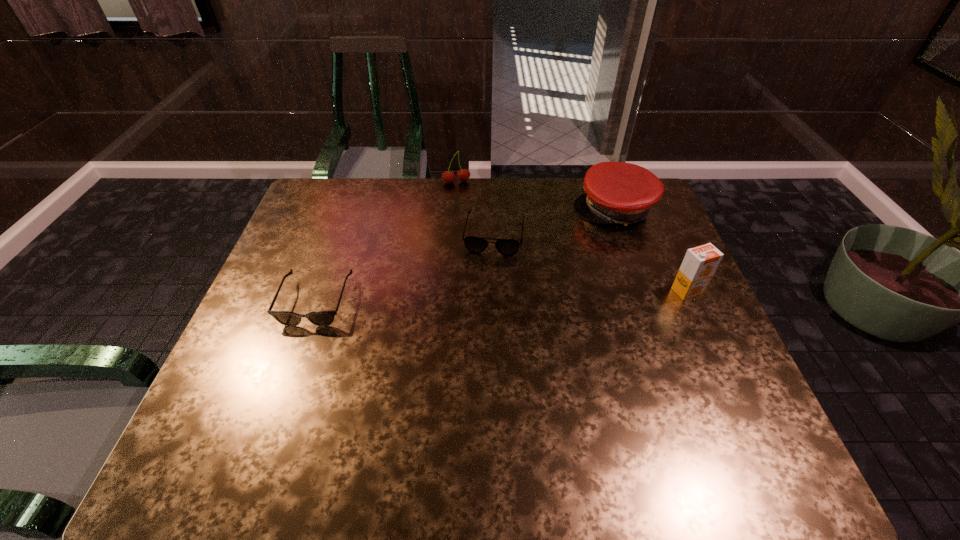
You are a GUI agent. You are given a task and a screenshot of the screen. Output one action in this format:
    pyautogui.click(x=<x>, y=<y>)
    Task: Click on the sunglasses
    This screenshot has width=960, height=540.
    Given the screenshot: What is the action you would take?
    pyautogui.click(x=320, y=318)

Where is `the tallest object`? The width and height of the screenshot is (960, 540). the tallest object is located at coordinates (700, 263).

You are a GUI agent. You are given a task and a screenshot of the screen. Output one action in this format:
    pyautogui.click(x=<x>, y=<y>)
    Task: Click on the farthest object
    This screenshot has height=540, width=960.
    Given the screenshot: What is the action you would take?
    pyautogui.click(x=463, y=175)

Locate an element on the screen. spectacles is located at coordinates (508, 247).

You are a GUI agent. You are given a task and a screenshot of the screen. Output one action in this format:
    pyautogui.click(x=<x>, y=<y>)
    Task: Click on the cap
    The width and height of the screenshot is (960, 540).
    Given the screenshot: What is the action you would take?
    pyautogui.click(x=616, y=192)

Identify the location of vacant point located 0.220m on the front lenses of the sunglasses. (277, 410).

Where is `vacant space positioned on the left of the orange juice`? The height and width of the screenshot is (540, 960). vacant space positioned on the left of the orange juice is located at coordinates (630, 291).

The height and width of the screenshot is (540, 960). In order to click on free space located 0.310m on the surface of the farthest object in this screenshot , I will do `click(471, 246)`.

The height and width of the screenshot is (540, 960). Identify the location of vacant space located 0.400m on the surface of the farthest object. (475, 267).

Where is `blank area located 0.200m on the surface of the farthest object`? The width and height of the screenshot is (960, 540). blank area located 0.200m on the surface of the farthest object is located at coordinates (x=466, y=223).